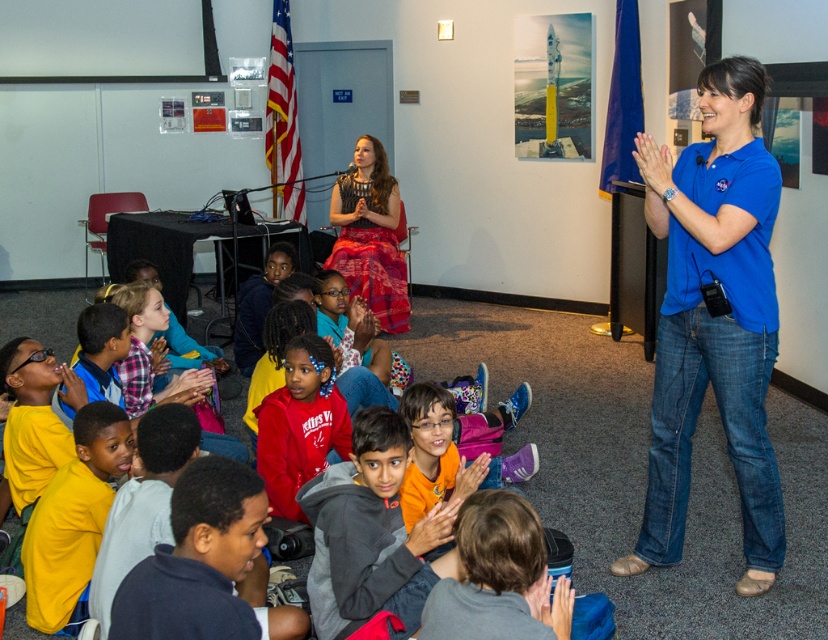
You are a photographer positioned at the center of the room. You want to take a photo of the blue cotton shirt at right. Which direction should you move to get a better shot?

The blue cotton shirt at right is located at point [715,317], so you should move to the right to get a better shot.

You are a teacher who needs to move a 1.2 meter wide desk between the blue cotton shirt at right and the gray fleece sweater at lower center. Is there enough space for the desk to fit through?

The distance between the blue cotton shirt at right and the gray fleece sweater at lower center is 1.43 meters. Since the desk is 1.2 meters wide, there is enough space for the desk to fit through as 1.43 meters is greater than 1.2 meters.

Based on the photo, you are a parent attending a school event and notice two gray fleece items in the image. Which one is bigger between the gray fleece jacket at center and the gray fleece sweater at lower center?

The gray fleece jacket at center is larger in size compared to the gray fleece sweater at lower center.